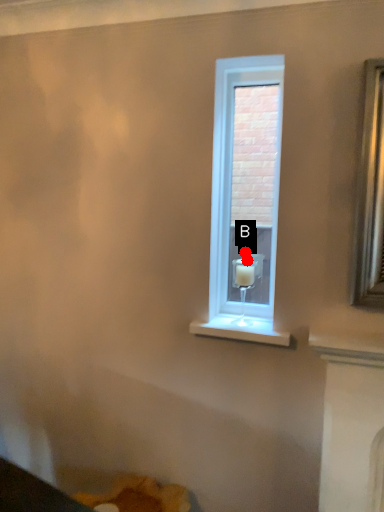
Question: Two points are circled on the image, labeled by A and B beside each circle. Which of the following is the farthest from the observer?

Choices:
 (A) A is further
 (B) B is further

Answer: (B)